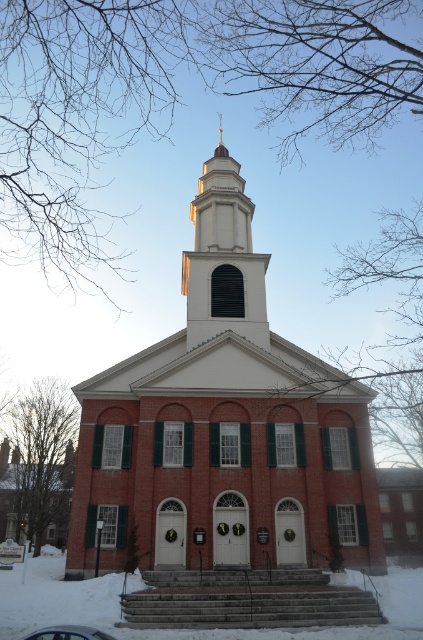
Who is taller, white smooth steeple at center or metallic silver car at lower center?

With more height is white smooth steeple at center.

Between white smooth steeple at center and metallic silver car at lower center, which one appears on the left side from the viewer's perspective?

metallic silver car at lower center

At what (x,y) coordinates should I click in order to perform the action: click on white smooth steeple at center. Please return your answer as a coordinate pair (x, y). The height and width of the screenshot is (640, 423). Looking at the image, I should click on (224, 259).

Locate an element on the screen. This screenshot has height=640, width=423. brick church at center is located at coordinates (224, 428).

Locate an element on the screen. brick church at center is located at coordinates (224, 428).

This screenshot has width=423, height=640. In order to click on brick church at center in this screenshot , I will do `click(224, 428)`.

Is brick church at center behind white smooth steeple at center?

No, it is not.

I want to click on brick church at center, so click(x=224, y=428).